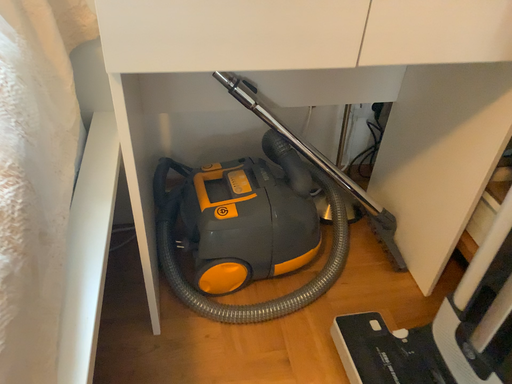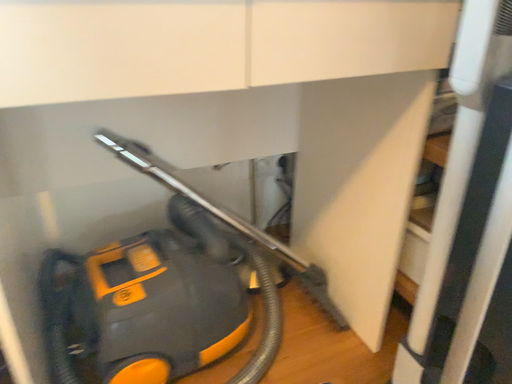
Question: Which way did the camera rotate in the video?

Choices:
 (A) rotated left
 (B) rotated right

Answer: (B)